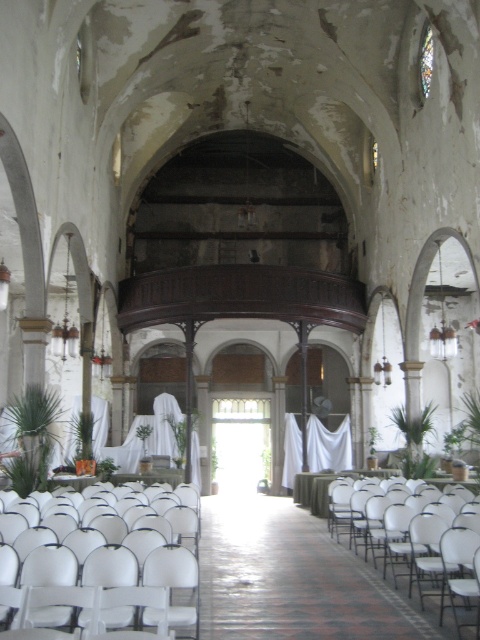
You are a stagehand setting up equipment in the church. You need to move a large soundboard that is 2 meters long from the entrance to the area near the white plastic chair at center. There is a row of white plastic chairs at lower center blocking the path. Can you move the soundboard through the space between the two rows of chairs?

The distance between the white plastic chairs at lower center and the white plastic chair at center is 8.12 meters. Since the soundboard is only 2 meters long, it can easily be maneuvered through the space as the distance is more than sufficient to accommodate its length.

You are an event planner setting up for a ceremony in this historic church. You need to place a decorative archway between the white plastic chairs at lower center and the white plastic chair at center. Based on their positions, which side of the archway should face the chairs to ensure it aligns with the central aisle?

The white plastic chairs at lower center is to the left of white plastic chair at center, so the archway should face towards the right side to align with the central aisle where the chairs are facing forward.

You are an event planner setting up for a ceremony in this historic church. You need to ensure that the white plastic chairs at lower center and the white plastic chair at center are arranged properly. Based on their positions, which chair is closer to the front of the aisle?

The white plastic chairs at lower center are closer to the front of the aisle because they are positioned in front of the white plastic chair at center.